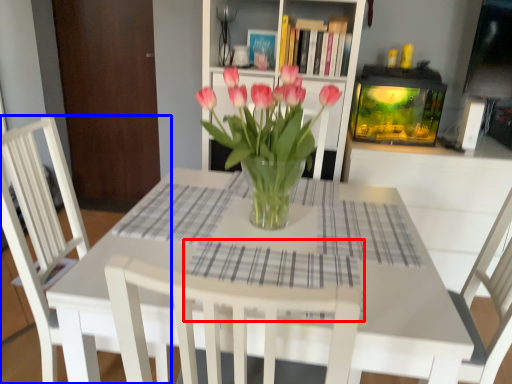
Question: Among these objects, which one is farthest to the camera, plaid (highlighted by a red box) or chair (highlighted by a blue box)?

Choices:
 (A) plaid
 (B) chair

Answer: (B)